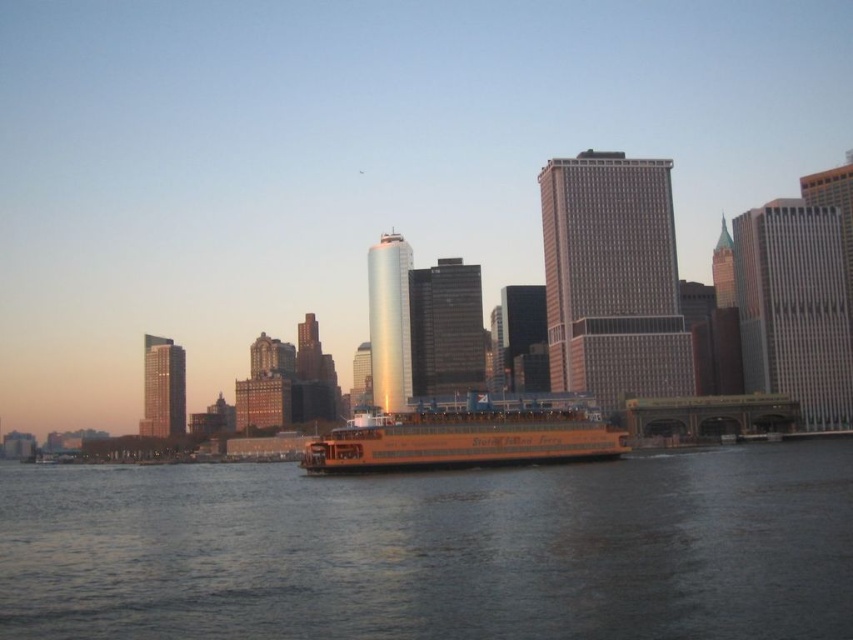
You are an architect designing a new observation deck that needs to be 2 meters tall. Based on the image, will the deck be visible above the brown water at center when placed next to the yellow matte ferry at center?

The brown water at center is much taller than the yellow matte ferry at center, so the 2 meter observation deck may not be visible above the water if placed next to the ferry.

You are a photographer planning to capture the waterfront scene. You want to ensure that both the brown water at center and the yellow matte ferry at center are clearly visible in your shot. Given their sizes, which object should you focus on first to ensure they both fit in the frame?

The brown water at center is bigger than the yellow matte ferry at center, so you should focus on framing the larger brown water at center first to ensure both fit in the shot.

You are a tourist standing on the waterfront and see the brown water at center and the yellow matte ferry at center. Which object is closer to the water surface?

The yellow matte ferry at center is closer to the water surface because the brown water at center is below it.